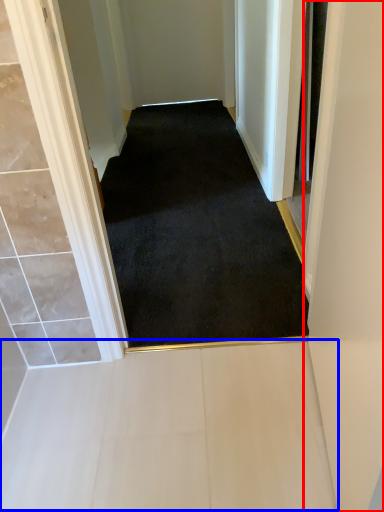
Question: Which of the following is the farthest to the observer, door (highlighted by a red box) or path (highlighted by a blue box)?

Choices:
 (A) door
 (B) path

Answer: (B)